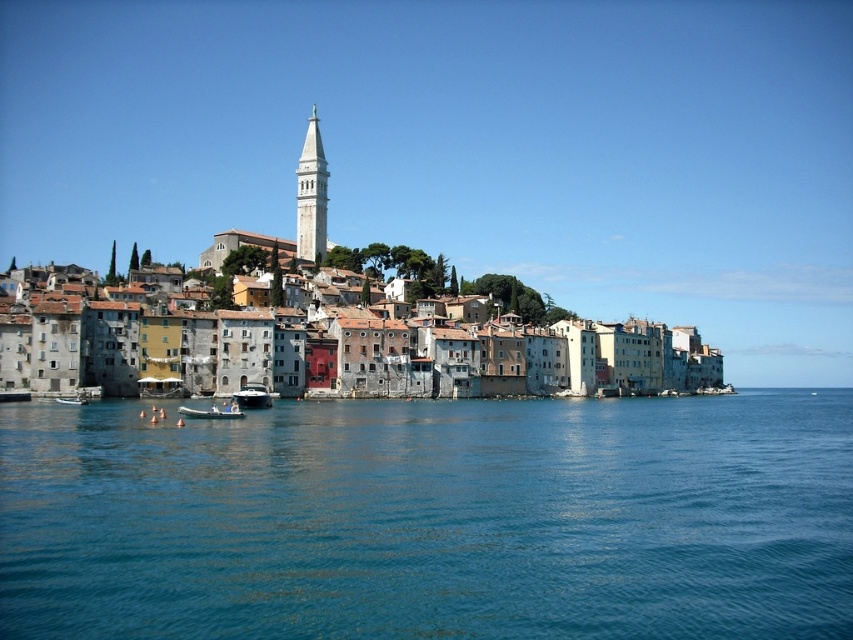
Can you confirm if white glossy boat at center is positioned to the right of white plastic boat at lower left?

Yes, white glossy boat at center is to the right of white plastic boat at lower left.

Does white glossy boat at center have a lesser width compared to white plastic boat at lower left?

No, white glossy boat at center is not thinner than white plastic boat at lower left.

Between point (252, 404) and point (82, 403), which one is positioned in front?

Point (82, 403) is in front.

You are a GUI agent. You are given a task and a screenshot of the screen. Output one action in this format:
    pyautogui.click(x=<x>, y=<y>)
    Task: Click on the white glossy boat at center
    This screenshot has width=853, height=640.
    Given the screenshot: What is the action you would take?
    pyautogui.click(x=252, y=396)

Can you confirm if multicolored stone buildings at center is thinner than green rubber dinghy at lower center?

No.

Between point (648, 339) and point (225, 410), which one is positioned behind?

Positioned behind is point (648, 339).

Locate an element on the screen. The image size is (853, 640). multicolored stone buildings at center is located at coordinates (663, 362).

Can you confirm if green rubber dinghy at lower center is positioned above white plastic boat at lower left?

Incorrect, green rubber dinghy at lower center is not positioned above white plastic boat at lower left.

Does green rubber dinghy at lower center have a greater height compared to white plastic boat at lower left?

Yes, green rubber dinghy at lower center is taller than white plastic boat at lower left.

Is point (231, 413) positioned after point (77, 403)?

No, it is not.

I want to click on green rubber dinghy at lower center, so click(212, 412).